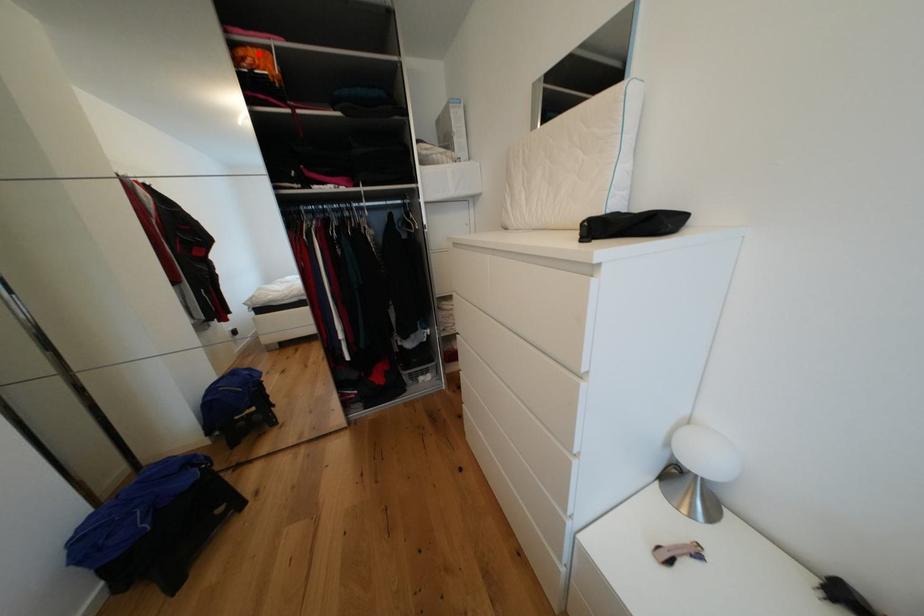
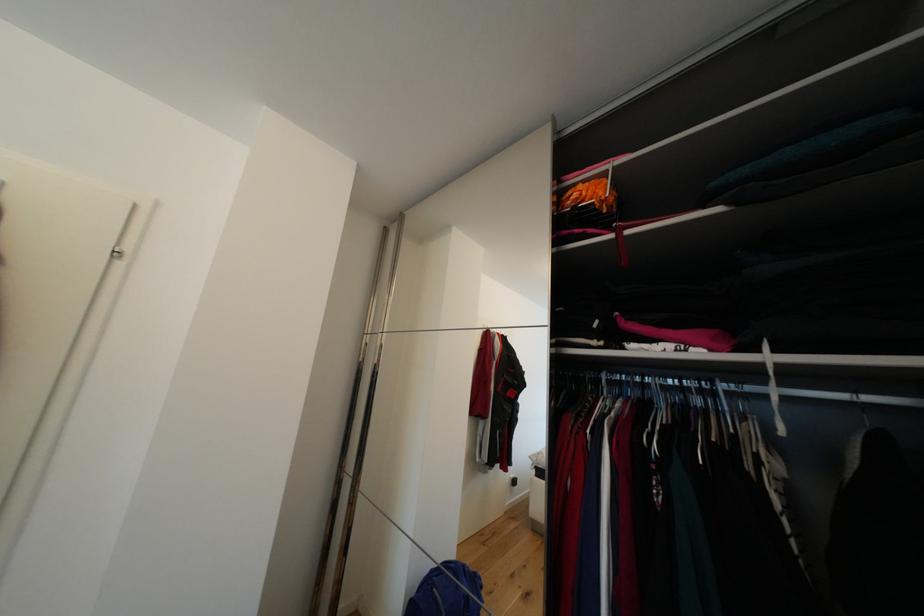
The point at the highlighted location is marked in the first image. Where is the corresponding point in the second image?

(588, 188)